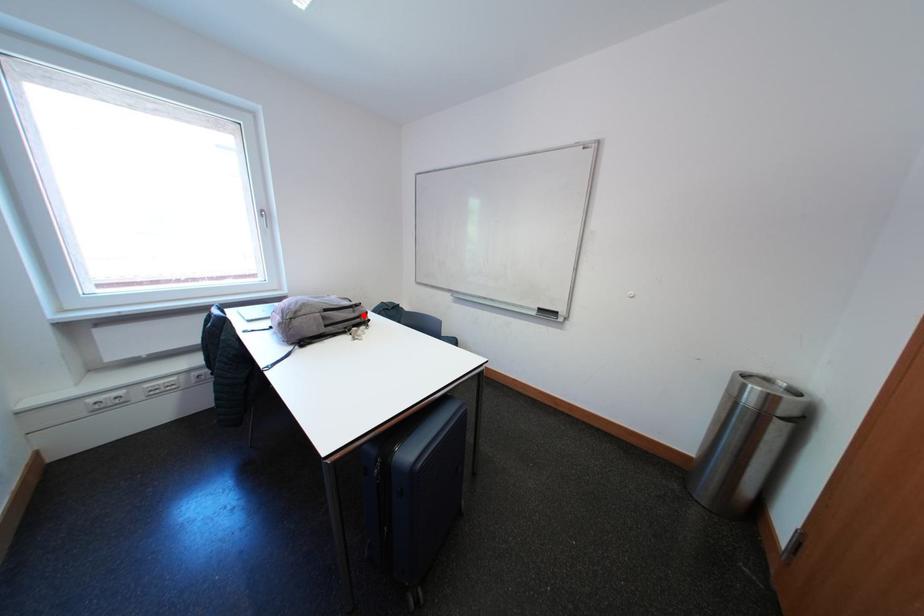
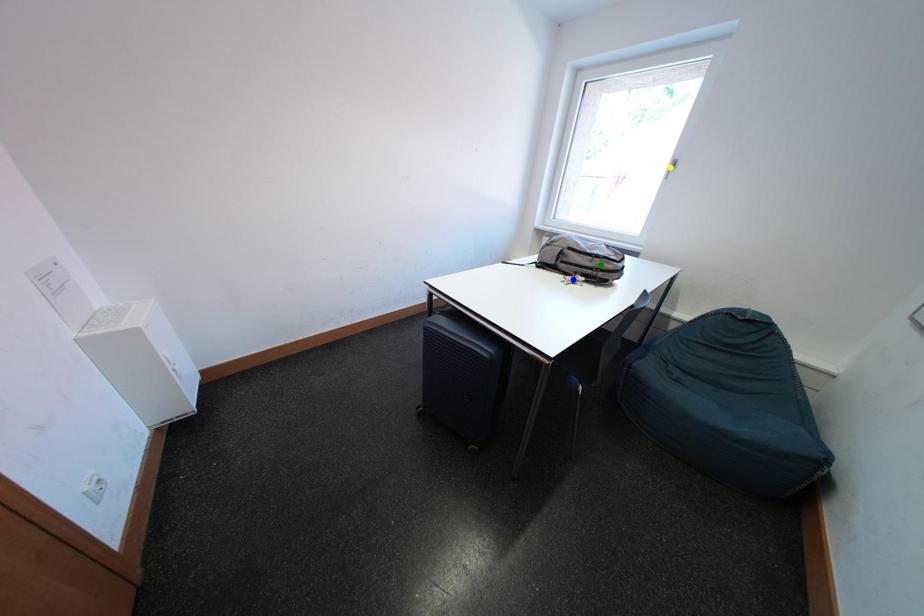
Question: I am providing you with two images of the same scene from different viewpoints. A red point is marked on the first image. You are given multiple points on the second image. Which mark in image 2 goes with the point in image 1?

Choices:
 (A) yellow point
 (B) blue point
 (C) green point

Answer: (C)